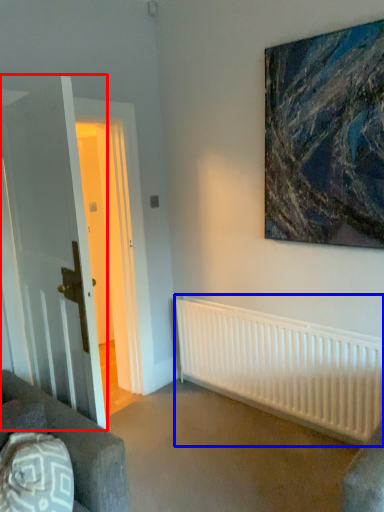
Question: Which object is closer to the camera taking this photo, glass door (highlighted by a red box) or radiator (highlighted by a blue box)?

Choices:
 (A) glass door
 (B) radiator

Answer: (A)